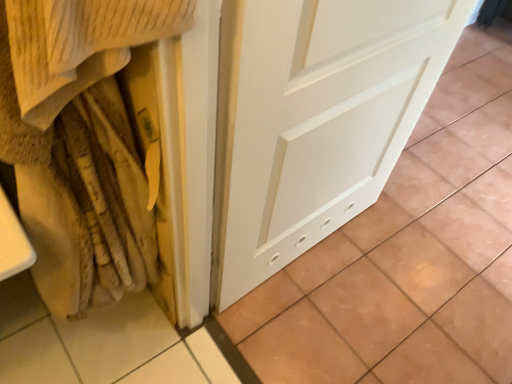
Question: Is white matte door at center situated inside beige textured blanket at left or outside?

Choices:
 (A) outside
 (B) inside

Answer: (A)

Question: Looking at the image, does white matte door at center seem bigger or smaller compared to beige textured blanket at left?

Choices:
 (A) small
 (B) big

Answer: (B)

Question: In terms of height, does white matte door at center look taller or shorter compared to beige textured blanket at left?

Choices:
 (A) short
 (B) tall

Answer: (A)

Question: Would you say beige textured blanket at left is to the left or to the right of white matte door at center in the picture?

Choices:
 (A) right
 (B) left

Answer: (B)

Question: From a real-world perspective, is beige textured blanket at left above or below white matte door at center?

Choices:
 (A) below
 (B) above

Answer: (B)

Question: In terms of width, does beige textured blanket at left look wider or thinner when compared to white matte door at center?

Choices:
 (A) wide
 (B) thin

Answer: (B)

Question: Is beige textured blanket at left in front of or behind white matte door at center in the image?

Choices:
 (A) front
 (B) behind

Answer: (A)